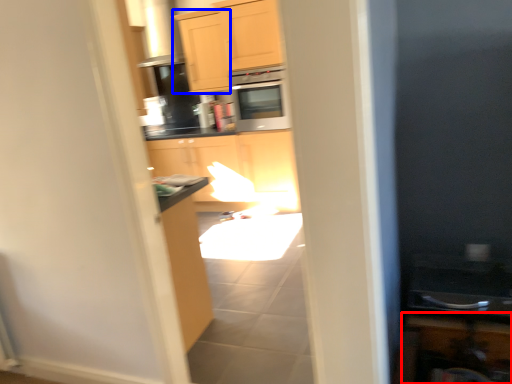
Question: Which object appears farthest to the camera in this image, cabinetry (highlighted by a red box) or cabinetry (highlighted by a blue box)?

Choices:
 (A) cabinetry
 (B) cabinetry

Answer: (B)